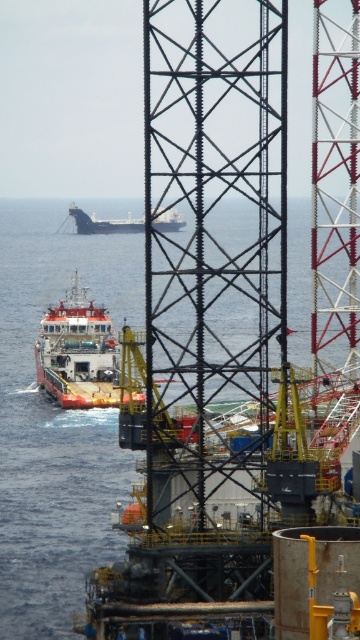
You are an observer on the deck of the oil rig. You notice a blue water at center and a white matte cargo ship at center. Which object is closer to you?

The white matte cargo ship at center is closer to you because it is positioned above the blue water at center.